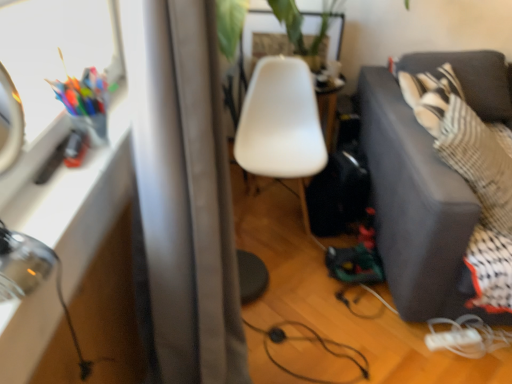
Question: Is white matte extension cord at lower right directly adjacent to clear glass table at left?

Choices:
 (A) no
 (B) yes

Answer: (A)

Question: Does white matte extension cord at lower right have a lesser height compared to clear glass table at left?

Choices:
 (A) yes
 (B) no

Answer: (A)

Question: Would you consider white matte extension cord at lower right to be distant from clear glass table at left?

Choices:
 (A) yes
 (B) no

Answer: (A)

Question: From the image's perspective, is white matte extension cord at lower right above clear glass table at left?

Choices:
 (A) no
 (B) yes

Answer: (A)

Question: From a real-world perspective, does white matte extension cord at lower right stand above clear glass table at left?

Choices:
 (A) yes
 (B) no

Answer: (B)

Question: Is point (382, 105) positioned closer to the camera than point (289, 89)?

Choices:
 (A) farther
 (B) closer

Answer: (B)

Question: Considering the relative positions of dark gray fabric couch at right and white plastic chair at center in the image provided, is dark gray fabric couch at right to the left or to the right of white plastic chair at center?

Choices:
 (A) left
 (B) right

Answer: (B)

Question: In the image, is dark gray fabric couch at right positioned in front of or behind white plastic chair at center?

Choices:
 (A) behind
 (B) front

Answer: (B)

Question: Which is correct: dark gray fabric couch at right is inside white plastic chair at center, or outside of it?

Choices:
 (A) outside
 (B) inside

Answer: (A)

Question: From a real-world perspective, is clear glass table at left positioned above or below dark gray fabric couch at right?

Choices:
 (A) above
 (B) below

Answer: (A)

Question: Considering the positions of clear glass table at left and dark gray fabric couch at right in the image, is clear glass table at left taller or shorter than dark gray fabric couch at right?

Choices:
 (A) tall
 (B) short

Answer: (B)

Question: Considering the positions of clear glass table at left and dark gray fabric couch at right in the image, is clear glass table at left bigger or smaller than dark gray fabric couch at right?

Choices:
 (A) big
 (B) small

Answer: (B)

Question: Looking at their shapes, would you say clear glass table at left is wider or thinner than dark gray fabric couch at right?

Choices:
 (A) wide
 (B) thin

Answer: (B)

Question: Considering the positions of white plastic chair at center and white matte extension cord at lower right in the image, is white plastic chair at center taller or shorter than white matte extension cord at lower right?

Choices:
 (A) tall
 (B) short

Answer: (A)

Question: Considering the positions of white plastic chair at center and white matte extension cord at lower right in the image, is white plastic chair at center bigger or smaller than white matte extension cord at lower right?

Choices:
 (A) small
 (B) big

Answer: (B)